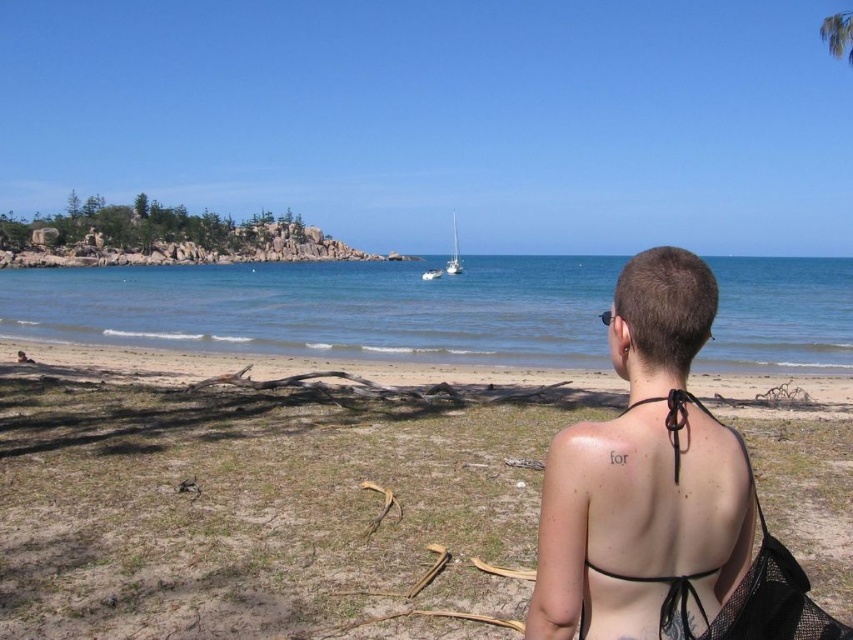
In the scene shown: Does clear blue water at center come behind green leafy palm tree at upper right?

That is False.

Measure the distance from clear blue water at center to green leafy palm tree at upper right.

53.82 meters

The image size is (853, 640). In order to click on clear blue water at center in this screenshot , I will do `click(328, 307)`.

Does brown sand at lower center have a lesser width compared to green leafy palm tree at upper right?

Yes, brown sand at lower center is thinner than green leafy palm tree at upper right.

Is brown sand at lower center below green leafy palm tree at upper right?

Yes, brown sand at lower center is below green leafy palm tree at upper right.

The height and width of the screenshot is (640, 853). Identify the location of brown sand at lower center. (262, 502).

Is green leafy palm tree at upper right taller than white glossy sailboat at center?

Yes, green leafy palm tree at upper right is taller than white glossy sailboat at center.

The image size is (853, 640). Identify the location of green leafy palm tree at upper right. (838, 35).

Is point (837, 44) farther from viewer compared to point (451, 257)?

No, it is not.

Where is `green leafy palm tree at upper right`? green leafy palm tree at upper right is located at coordinates (838, 35).